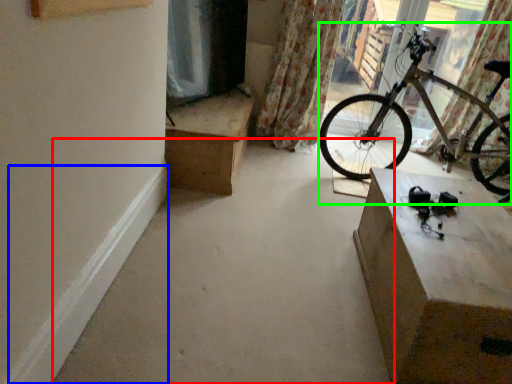
Question: Which object is the farthest from concrete (highlighted by a red box)? Choose among these: curb (highlighted by a blue box) or bicycle (highlighted by a green box).

Choices:
 (A) curb
 (B) bicycle

Answer: (B)